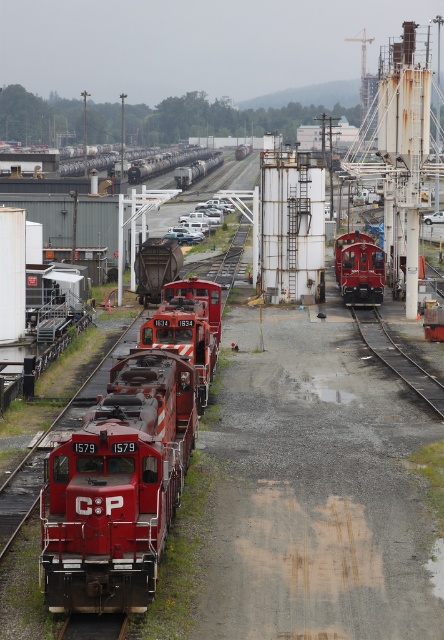
Question: Does shiny red train at center have a larger size compared to smooth metal train track at lower right?

Choices:
 (A) no
 (B) yes

Answer: (B)

Question: Which point is farther from the camera taking this photo?

Choices:
 (A) (409, 387)
 (B) (71, 580)
 (C) (351, 257)
 (D) (214, 294)

Answer: (C)

Question: Which of the following is the closest to the observer?

Choices:
 (A) matte red locomotive at left
 (B) smooth metal train track at lower right
 (C) matte red train at center
 (D) shiny red train at center

Answer: (A)

Question: Can you confirm if matte red train at center is positioned to the right of shiny red train at center?

Choices:
 (A) yes
 (B) no

Answer: (B)

Question: Does matte red locomotive at left have a larger size compared to smooth metal train track at lower right?

Choices:
 (A) yes
 (B) no

Answer: (A)

Question: Which point is farther from the camera taking this photo?

Choices:
 (A) (199, 358)
 (B) (127, 541)

Answer: (A)